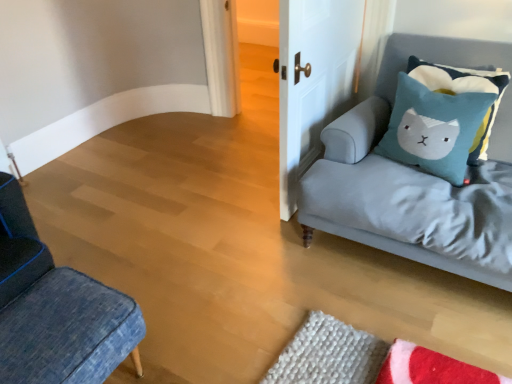
Question: Is blue felt pillow at upper right, which is counted as the first pillow, starting from the left, in front of white matte door at upper center?

Choices:
 (A) no
 (B) yes

Answer: (A)

Question: From a real-world perspective, is blue felt pillow at upper right, acting as the second pillow starting from the right, physically below white matte door at upper center?

Choices:
 (A) no
 (B) yes

Answer: (A)

Question: Does blue felt pillow at upper right, acting as the second pillow starting from the right, contain white matte door at upper center?

Choices:
 (A) yes
 (B) no

Answer: (B)

Question: Is blue felt pillow at upper right, acting as the second pillow starting from the right, to the left of white matte door at upper center from the viewer's perspective?

Choices:
 (A) yes
 (B) no

Answer: (B)

Question: Can you confirm if blue felt pillow at upper right, which is counted as the first pillow, starting from the left, is positioned to the right of white matte door at upper center?

Choices:
 (A) no
 (B) yes

Answer: (B)

Question: Are blue felt pillow at upper right, acting as the second pillow starting from the right, and white matte door at upper center located far from each other?

Choices:
 (A) no
 (B) yes

Answer: (A)

Question: From the image's perspective, is blue felt pillow at upper right, which is counted as the first pillow, starting from the left, beneath light gray fabric couch at right?

Choices:
 (A) no
 (B) yes

Answer: (A)

Question: Is the position of blue felt pillow at upper right, which is counted as the first pillow, starting from the left, more distant than that of light gray fabric couch at right?

Choices:
 (A) no
 (B) yes

Answer: (B)

Question: From a real-world perspective, is blue felt pillow at upper right, which is counted as the first pillow, starting from the left, physically above light gray fabric couch at right?

Choices:
 (A) no
 (B) yes

Answer: (B)

Question: Is blue felt pillow at upper right, which is counted as the first pillow, starting from the left, not within light gray fabric couch at right?

Choices:
 (A) yes
 (B) no

Answer: (B)

Question: Can you confirm if blue felt pillow at upper right, acting as the second pillow starting from the right, is thinner than light gray fabric couch at right?

Choices:
 (A) no
 (B) yes

Answer: (B)

Question: Is light gray fabric couch at right at the back of blue felt pillow at upper right, acting as the second pillow starting from the right?

Choices:
 (A) yes
 (B) no

Answer: (A)

Question: Can blue felt pillow at upper right, acting as the second pillow starting from the right, be found inside white matte door at upper center?

Choices:
 (A) no
 (B) yes

Answer: (A)